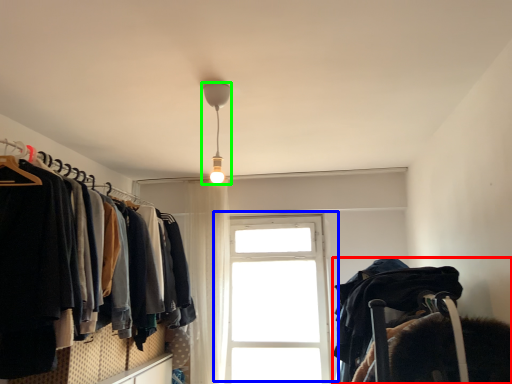
Question: Estimate the real-world distances between objects in this image. Which object is farther from bunk bed (highlighted by a red box), window (highlighted by a blue box) or lamp (highlighted by a green box)?

Choices:
 (A) window
 (B) lamp

Answer: (A)